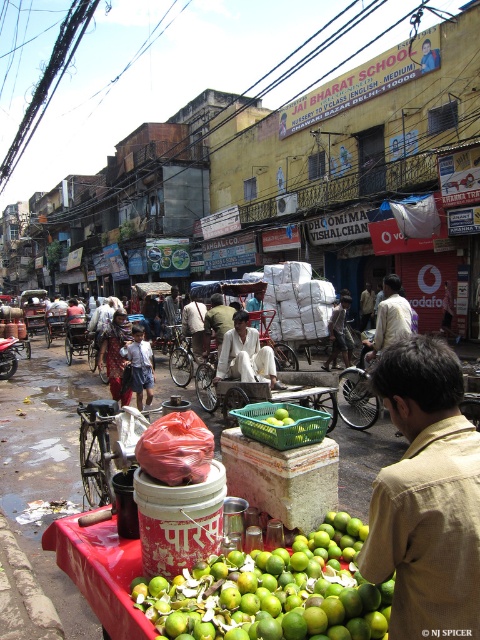
Question: Can you confirm if green matte limes at center is positioned below green plastic basket at center?

Choices:
 (A) yes
 (B) no

Answer: (B)

Question: Estimate the real-world distances between objects in this image. Which object is closer to the green plastic crate at center?

Choices:
 (A) plastic red cart at center
 (B) light brown cotton pants at center

Answer: (B)

Question: Can you confirm if light brown cotton pants at center is positioned above plastic red cart at center?

Choices:
 (A) no
 (B) yes

Answer: (B)

Question: Can you confirm if green matte limes at center is positioned above green plastic crate at center?

Choices:
 (A) yes
 (B) no

Answer: (B)

Question: Estimate the real-world distances between objects in this image. Which object is closer to the green plastic basket at center?

Choices:
 (A) green matte limes at center
 (B) light brown cotton pants at center
 (C) plastic red cart at center

Answer: (B)

Question: Which object is the closest to the plastic red cart at center?

Choices:
 (A) green plastic basket at center
 (B) brown cotton shirt at center

Answer: (A)